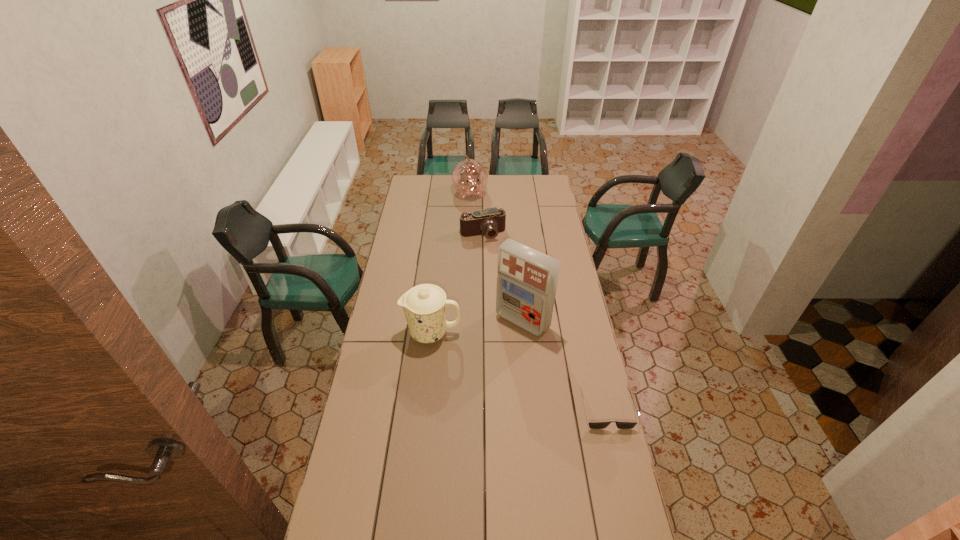
Find the location of a particular element. The width and height of the screenshot is (960, 540). free space located on the front facing side of the piggy bank is located at coordinates (483, 231).

Find the location of a particular element. Image resolution: width=960 pixels, height=540 pixels. vacant space situated 0.260m on the front-facing side of the first-aid kit is located at coordinates (470, 376).

The image size is (960, 540). What are the coordinates of `vacant point located 0.120m on the front-facing side of the first-aid kit` in the screenshot? It's located at (491, 353).

This screenshot has width=960, height=540. Identify the location of vacant space positioned on the front-facing side of the first-aid kit. (499, 344).

I want to click on blank area located on the front-facing side of the second farthest object, so click(501, 278).

Identify the location of free spot located 0.050m on the front-facing side of the second farthest object. click(x=491, y=249).

The image size is (960, 540). What are the coordinates of `vacant region located 0.380m on the front-facing side of the second farthest object` in the screenshot? It's located at (507, 291).

Identify the location of object located at the far edge. Image resolution: width=960 pixels, height=540 pixels. (469, 177).

At what (x,y) coordinates should I click in order to perform the action: click on object that is at the left edge. Please return your answer as a coordinate pair (x, y). Image resolution: width=960 pixels, height=540 pixels. Looking at the image, I should click on (424, 305).

I want to click on sunglasses present at the right edge, so click(x=592, y=425).